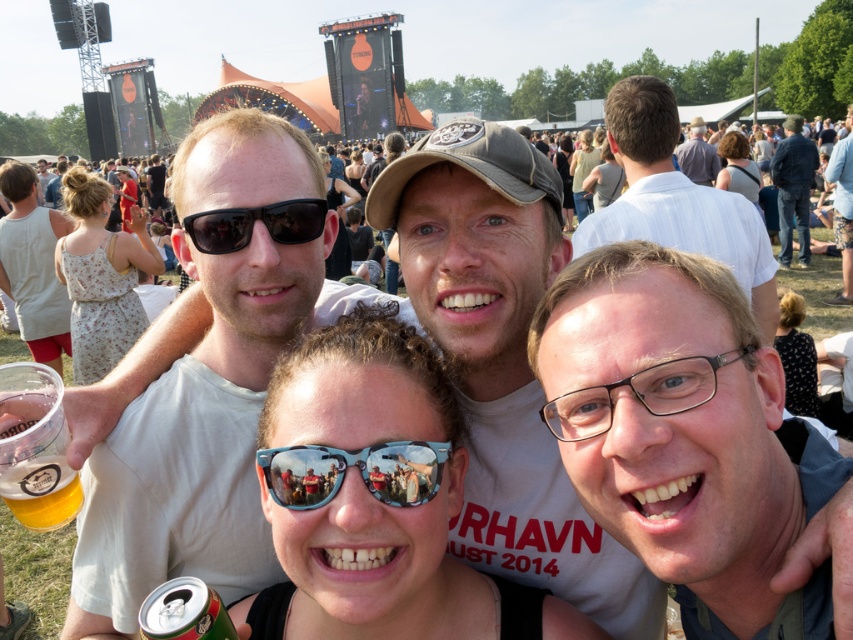
Question: Which object is positioned farthest from the blue reflective sunglasses at center?

Choices:
 (A) translucent plastic cup at lower left
 (B) dark blue jeans at right
 (C) matte white shirt at center
 (D) white t-shirt at center

Answer: (B)

Question: Is white shirt at upper center positioned behind blue reflective sunglasses at center?

Choices:
 (A) yes
 (B) no

Answer: (A)

Question: Does white shirt at upper center have a larger size compared to white cotton tank top at upper left?

Choices:
 (A) no
 (B) yes

Answer: (B)

Question: Among these objects, which one is farthest from the camera?

Choices:
 (A) dark blue jeans at right
 (B) blue reflective sunglasses at center
 (C) matte white shirt at center
 (D) white cotton tank top at upper left

Answer: (A)

Question: Is white t-shirt at center further to the viewer compared to black matte sunglasses at center?

Choices:
 (A) yes
 (B) no

Answer: (B)

Question: Which object is farther from the camera taking this photo?

Choices:
 (A) white shirt at upper center
 (B) blue reflective sunglasses at center
 (C) matte white t-shirt at upper center

Answer: (C)